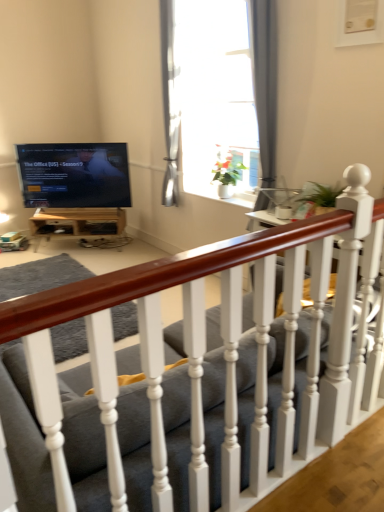
Question: Could you tell me if matte gray fabric couch at center is facing matte black tv at upper left?

Choices:
 (A) no
 (B) yes

Answer: (B)

Question: Is the position of matte gray fabric couch at center more distant than that of matte black tv at upper left?

Choices:
 (A) no
 (B) yes

Answer: (A)

Question: From a real-world perspective, does matte gray fabric couch at center stand above matte black tv at upper left?

Choices:
 (A) no
 (B) yes

Answer: (A)

Question: Does matte gray fabric couch at center appear on the right side of matte black tv at upper left?

Choices:
 (A) no
 (B) yes

Answer: (B)

Question: Can you confirm if matte gray fabric couch at center is smaller than matte black tv at upper left?

Choices:
 (A) yes
 (B) no

Answer: (B)

Question: Can you confirm if matte gray fabric couch at center is bigger than matte black tv at upper left?

Choices:
 (A) no
 (B) yes

Answer: (B)

Question: Can you confirm if matte gray fabric couch at center is wider than white glossy window at upper center?

Choices:
 (A) yes
 (B) no

Answer: (A)

Question: Is matte gray fabric couch at center behind white glossy window at upper center?

Choices:
 (A) yes
 (B) no

Answer: (B)

Question: Is the position of matte gray fabric couch at center less distant than that of white glossy window at upper center?

Choices:
 (A) yes
 (B) no

Answer: (A)

Question: Does matte gray fabric couch at center have a lesser width compared to white glossy window at upper center?

Choices:
 (A) yes
 (B) no

Answer: (B)

Question: Would you say matte gray fabric couch at center contains white glossy window at upper center?

Choices:
 (A) no
 (B) yes

Answer: (A)

Question: Can you confirm if matte gray fabric couch at center is taller than white glossy window at upper center?

Choices:
 (A) no
 (B) yes

Answer: (A)

Question: Is wooden table at lower left in contact with matte gray fabric couch at center?

Choices:
 (A) no
 (B) yes

Answer: (A)